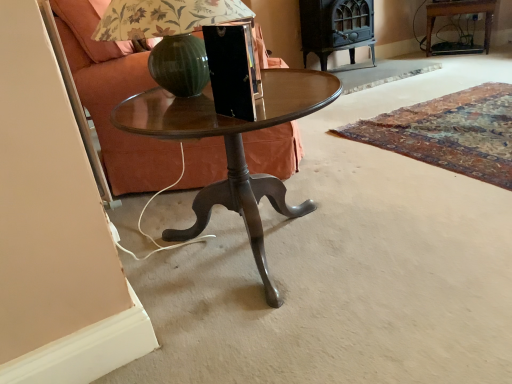
This screenshot has height=384, width=512. Find the location of `vacant space to the right of matte brown fabric armchair at left`. vacant space to the right of matte brown fabric armchair at left is located at coordinates (357, 141).